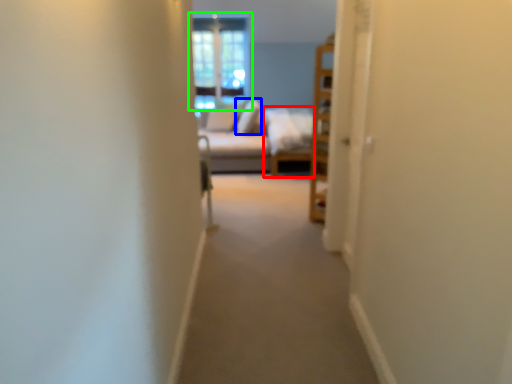
Question: Which object is the farthest from couch (highlighted by a red box)? Choose among these: pillow (highlighted by a blue box) or window (highlighted by a green box).

Choices:
 (A) pillow
 (B) window

Answer: (B)